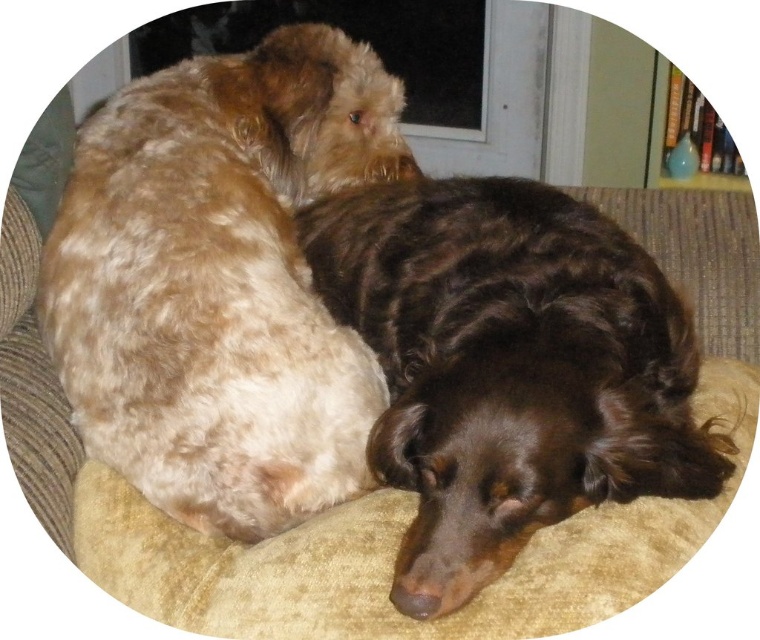
Is point (70, 296) behind point (540, 349)?

That is True.

What do you see at coordinates (220, 280) in the screenshot? I see `brown shaggy dog at upper left` at bounding box center [220, 280].

Is point (109, 243) farther from camera compared to point (567, 243)?

Yes.

Locate an element on the screen. Image resolution: width=760 pixels, height=640 pixels. brown shaggy dog at upper left is located at coordinates (220, 280).

Can you confirm if brown shaggy dog at lower right is thinner than beige fabric dog bed at center?

Yes.

Find the location of a particular element. The height and width of the screenshot is (640, 760). brown shaggy dog at lower right is located at coordinates (508, 365).

This screenshot has width=760, height=640. What do you see at coordinates (508, 365) in the screenshot?
I see `brown shaggy dog at lower right` at bounding box center [508, 365].

Where is `brown shaggy dog at lower right`? brown shaggy dog at lower right is located at coordinates point(508,365).

Consider the image. Is brown shaggy dog at upper left above beige fabric dog bed at center?

Yes.

Who is taller, brown shaggy dog at upper left or beige fabric dog bed at center?

brown shaggy dog at upper left is taller.

This screenshot has height=640, width=760. What do you see at coordinates (220, 280) in the screenshot?
I see `brown shaggy dog at upper left` at bounding box center [220, 280].

Where is `brown shaggy dog at upper left`? This screenshot has width=760, height=640. brown shaggy dog at upper left is located at coordinates (220, 280).